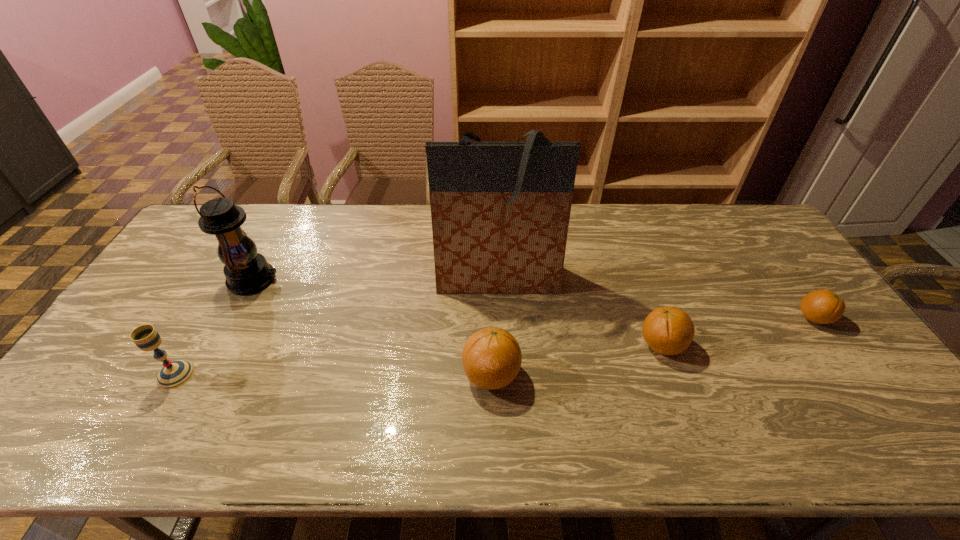
Where is `object that can be found as the closest to the second orange from right to left`? The height and width of the screenshot is (540, 960). object that can be found as the closest to the second orange from right to left is located at coordinates (500, 211).

Identify which object is the third closest to the third shortest object. Please provide its 2D coordinates. Your answer should be formatted as a tuple, i.e. [(x, y)], where the tuple contains the x and y coordinates of a point satisfying the conditions above.

[(246, 271)]

At what (x,y) coordinates should I click in order to perform the action: click on the second closest orange to the fifth shortest object. Please return your answer as a coordinate pair (x, y). Image resolution: width=960 pixels, height=540 pixels. Looking at the image, I should click on (667, 330).

Locate an element on the screen. the closest orange to the lantern is located at coordinates (491, 357).

You are a GUI agent. You are given a task and a screenshot of the screen. Output one action in this format:
    pyautogui.click(x=<x>, y=<y>)
    Task: Click on the vacant space that satisfies the following two spatial constraints: 1. on the back side of the chalice; 2. on the right side of the rightmost object
    The height and width of the screenshot is (540, 960).
    Given the screenshot: What is the action you would take?
    pyautogui.click(x=208, y=318)

I want to click on vacant space that satisfies the following two spatial constraints: 1. above the second tallest object, indicating its light source; 2. on the right side of the rightmost object, so click(x=233, y=318).

The image size is (960, 540). Identify the location of free space that satisfies the following two spatial constraints: 1. on the back side of the leftmost orange; 2. above the fifth shortest object, indicating its light source. (490, 279).

The height and width of the screenshot is (540, 960). What are the coordinates of `blank area in the image that satisfies the following two spatial constraints: 1. above the fourth tallest object, indicating its light source; 2. on the right side of the lantern` in the screenshot? It's located at (204, 375).

The width and height of the screenshot is (960, 540). Identify the location of vacant area in the image that satisfies the following two spatial constraints: 1. above the shortest orange, indicating its light source; 2. on the left side of the fifth shortest object. (233, 318).

The image size is (960, 540). Identify the location of vacant space that satisfies the following two spatial constraints: 1. on the back side of the rightmost object; 2. above the lantern, indicating its light source. (786, 279).